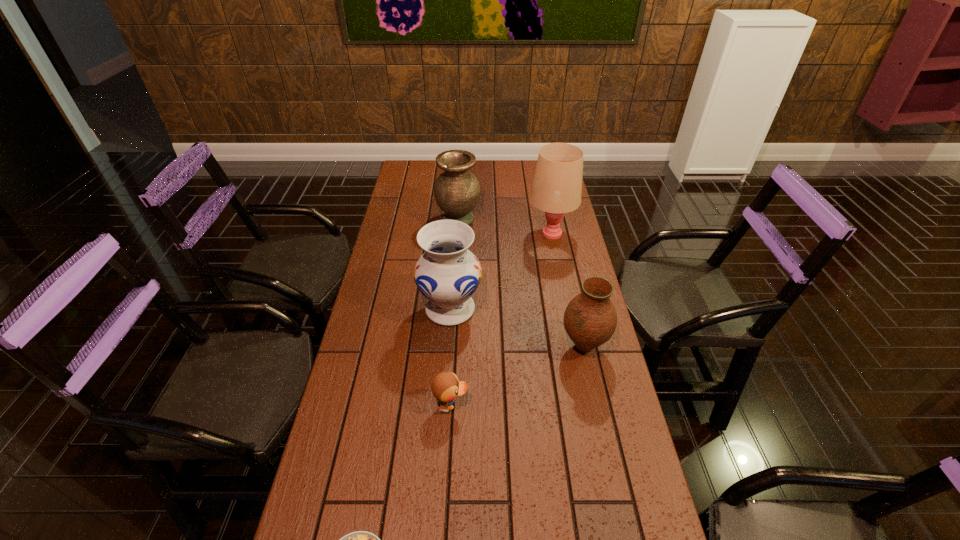
I want to click on vase at the right edge, so click(590, 319).

You are a GUI agent. You are given a task and a screenshot of the screen. Output one action in this format:
    pyautogui.click(x=<x>, y=<y>)
    Task: Click on the vacant space at the left edge
    
    Given the screenshot: What is the action you would take?
    pyautogui.click(x=400, y=285)

This screenshot has height=540, width=960. In the image, there is a desktop. What are the coordinates of `free space at the right edge` in the screenshot? It's located at (561, 289).

Identify the location of vacant space at the far left corner of the desktop. (428, 172).

Image resolution: width=960 pixels, height=540 pixels. In order to click on free spot between the second nearest object and the rightmost vase in this screenshot , I will do click(x=517, y=376).

The width and height of the screenshot is (960, 540). What are the coordinates of `vacant area that lies between the duck and the rightmost vase` in the screenshot? It's located at (517, 376).

Where is `empty space between the lampshade and the second shortest object`? Image resolution: width=960 pixels, height=540 pixels. empty space between the lampshade and the second shortest object is located at coordinates (501, 319).

I want to click on vacant space that is in between the rightmost vase and the farthest vase, so click(521, 284).

The width and height of the screenshot is (960, 540). Identify the location of empty location between the farthest vase and the rightmost vase. (521, 284).

I want to click on free space that is in between the fifth tallest object and the lampshade, so click(501, 319).